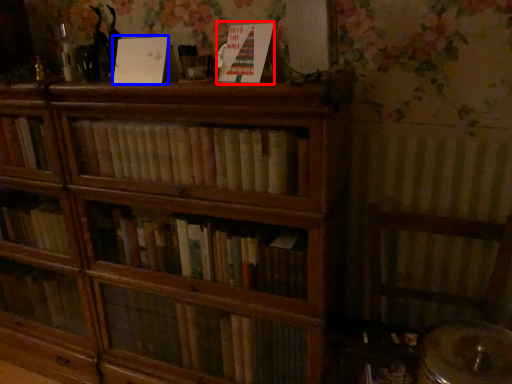
Question: Which object is further to the camera taking this photo, paperback book (highlighted by a red box) or paperback book (highlighted by a blue box)?

Choices:
 (A) paperback book
 (B) paperback book

Answer: (B)